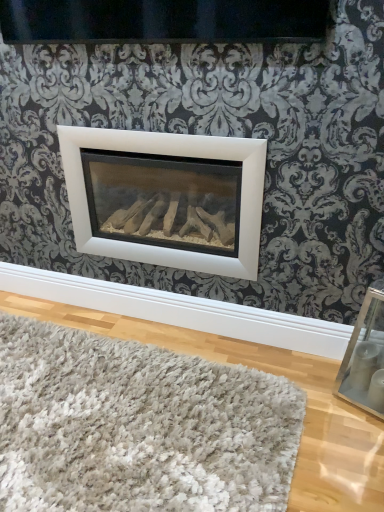
Question: From the image's perspective, is white matte fireplace at center located above or below clear glass picture frame at lower right?

Choices:
 (A) above
 (B) below

Answer: (A)

Question: Considering the positions of white matte fireplace at center and clear glass picture frame at lower right in the image, is white matte fireplace at center wider or thinner than clear glass picture frame at lower right?

Choices:
 (A) wide
 (B) thin

Answer: (A)

Question: Which of these objects is positioned farthest from the white shaggy rug at lower center?

Choices:
 (A) clear glass picture frame at lower right
 (B) white matte fireplace at center

Answer: (B)

Question: Considering the real-world distances, which object is farthest from the white matte fireplace at center?

Choices:
 (A) clear glass picture frame at lower right
 (B) white shaggy rug at lower center

Answer: (A)